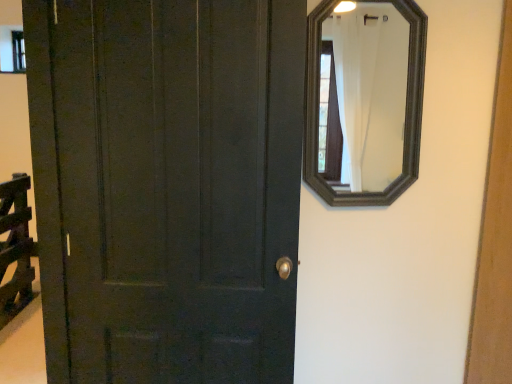
Question: From a real-world perspective, is transparent glass window at upper left above or below matte dark green door at left?

Choices:
 (A) above
 (B) below

Answer: (A)

Question: Is transparent glass window at upper left taller or shorter than matte dark green door at left?

Choices:
 (A) tall
 (B) short

Answer: (B)

Question: Which object is positioned farthest from the transparent glass window at upper left?

Choices:
 (A) matte dark green door at left
 (B) black wooden mirror at upper right

Answer: (B)

Question: Which is nearer to the transparent glass window at upper left?

Choices:
 (A) black wooden mirror at upper right
 (B) matte dark green door at left

Answer: (B)